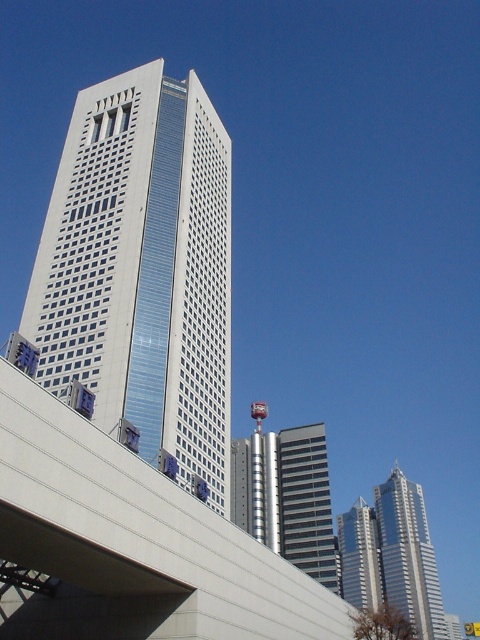
Question: Can you confirm if white glass skyscraper at center is thinner than concrete overpass at center?

Choices:
 (A) yes
 (B) no

Answer: (B)

Question: Which object is the farthest from the silver metallic skyscraper at center?

Choices:
 (A) shiny silver skyscraper at right
 (B) white glass skyscraper at center
 (C) dark gray glass building at center
 (D) concrete overpass at center

Answer: (D)

Question: Is white glass skyscraper at center below silver metallic skyscraper at center?

Choices:
 (A) yes
 (B) no

Answer: (B)

Question: Which point is farther to the camera?

Choices:
 (A) white glass skyscraper at center
 (B) shiny silver skyscraper at right
 (C) dark gray glass building at center
 (D) concrete overpass at center

Answer: (B)

Question: Which point is farther from the camera taking this photo?

Choices:
 (A) (62, 397)
 (B) (265, 570)
 (C) (393, 516)

Answer: (C)

Question: Observing the image, what is the correct spatial positioning of concrete overpass at center in reference to shiny silver skyscraper at right?

Choices:
 (A) below
 (B) above

Answer: (B)